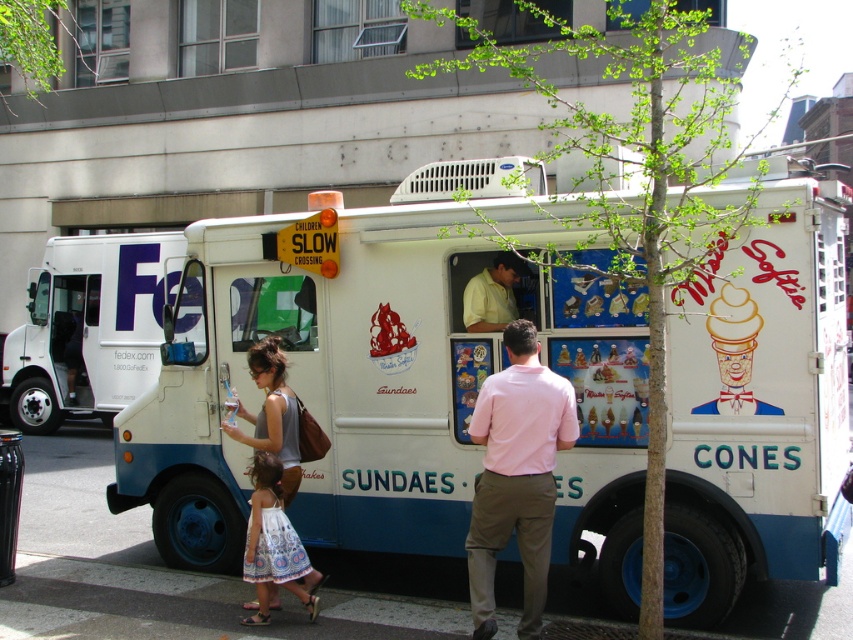
You are a pedestrian trying to cross the street safely. You see the white matte ice cream truck at center and the pink cotton shirt at center. Which object is closer to you?

The pink cotton shirt at center is closer to you because the white matte ice cream truck at center is positioned over it, meaning the truck is behind the shirt.

You are a delivery person who needs to place a small package between the white printed dress at lower center and the matte gray tank top at center. Is there enough space to fit the package, which is 10 inches long?

The white printed dress at lower center is 9.73 inches away from the matte gray tank top at center. Since the package is 10 inches long, it would not fit between them as the distance is slightly less than the package length.